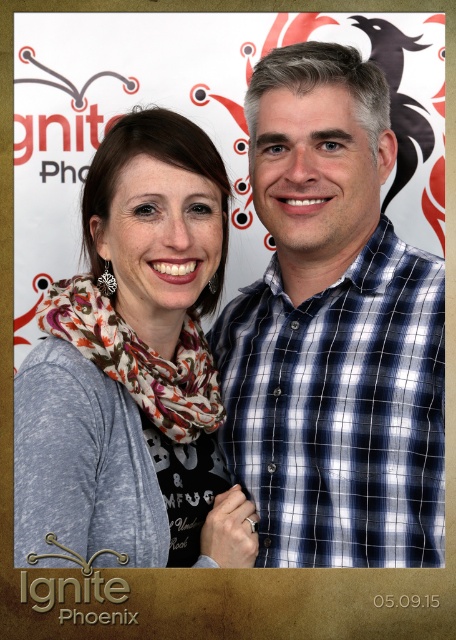
Question: Which object is closer to the camera taking this photo?

Choices:
 (A) floral print scarf at upper left
 (B) blue checkered shirt at center
 (C) printed scarf at center

Answer: (C)

Question: Is printed scarf at center below floral print scarf at upper left?

Choices:
 (A) no
 (B) yes

Answer: (A)

Question: Is blue checkered shirt at center to the left of printed scarf at center from the viewer's perspective?

Choices:
 (A) no
 (B) yes

Answer: (A)

Question: Is blue checkered shirt at center wider than floral print scarf at upper left?

Choices:
 (A) yes
 (B) no

Answer: (A)

Question: Which point is closer to the camera?

Choices:
 (A) blue checkered shirt at center
 (B) floral print scarf at upper left
 (C) printed scarf at center

Answer: (C)

Question: Among these points, which one is nearest to the camera?

Choices:
 (A) (57, 321)
 (B) (351, 317)

Answer: (A)